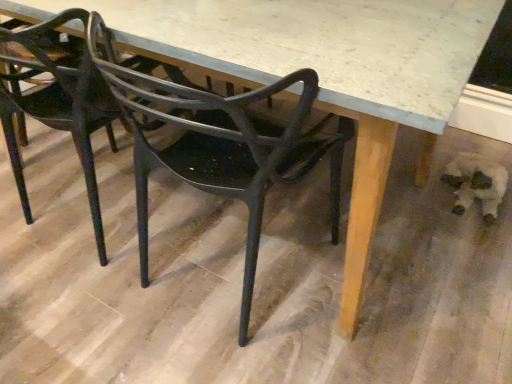
Identify the location of vacant space to the right of matte black chair at center, marked as the first chair in a right-to-left arrangement. The image size is (512, 384). (395, 284).